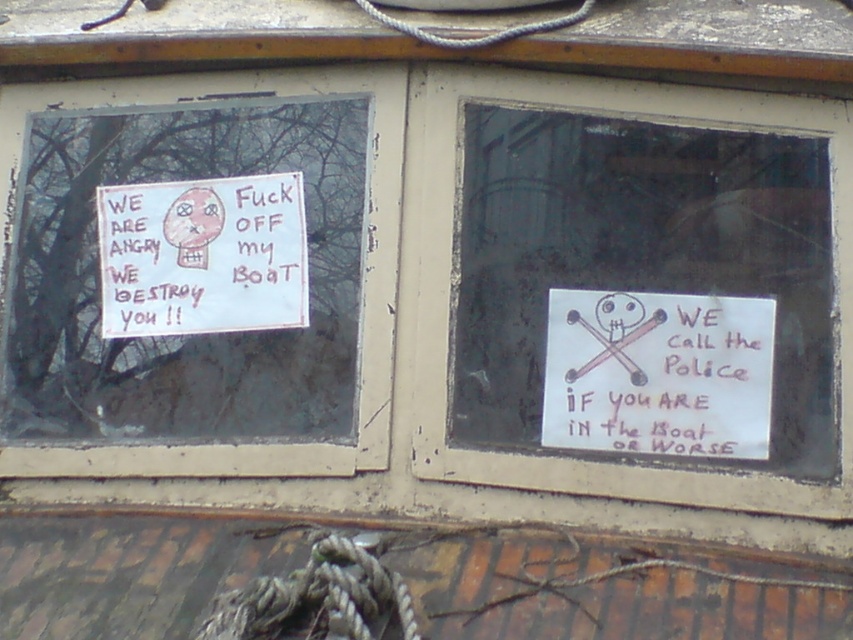
Does white paper sign at right lie in front of white paper sign at left?

That is True.

Is white paper sign at right smaller than white paper sign at left?

Yes, white paper sign at right is smaller than white paper sign at left.

Measure the distance between point (576, 403) and camera.

Result: A distance of 3.06 meters exists between point (576, 403) and camera.

Locate an element on the screen. This screenshot has width=853, height=640. white paper sign at right is located at coordinates (659, 372).

Is white paper sign at upper left bigger than white paper sign at right?

Indeed, white paper sign at upper left has a larger size compared to white paper sign at right.

Which is in front, point (572, 458) or point (728, 314)?

Point (572, 458) is in front.

Locate an element on the screen. white paper sign at upper left is located at coordinates [451, 289].

Is white paper sign at upper left positioned before white paper sign at left?

Yes.

This screenshot has width=853, height=640. In order to click on white paper sign at upper left in this screenshot , I will do `click(451, 289)`.